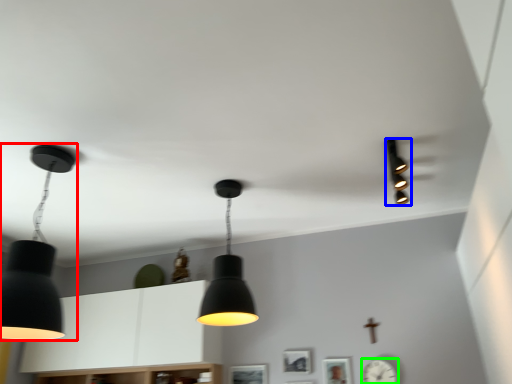
Question: Based on their relative distances, which object is farther from lamp (highlighted by a red box)? Choose from lamp (highlighted by a blue box) and clock (highlighted by a green box).

Choices:
 (A) lamp
 (B) clock

Answer: (B)